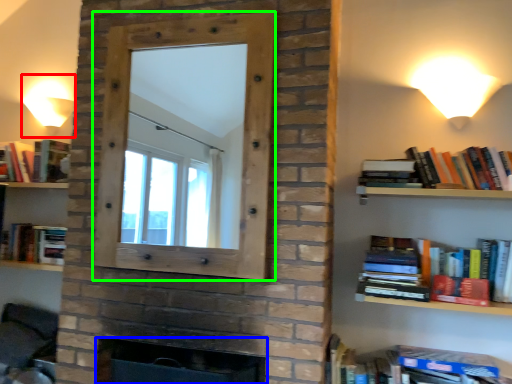
Question: Considering the real-world distances, which object is farthest from table lamp (highlighted by a red box)? fireplace (highlighted by a blue box) or window frame (highlighted by a green box)?

Choices:
 (A) fireplace
 (B) window frame

Answer: (A)